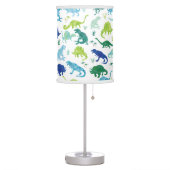
The height and width of the screenshot is (170, 170). I want to click on lamp pull cord, so click(x=92, y=95).